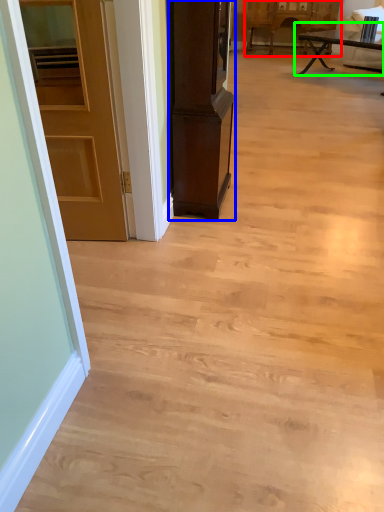
Question: Estimate the real-world distances between objects in this image. Which object is farther from cabinetry (highlighted by a red box), cabinetry (highlighted by a blue box) or table (highlighted by a green box)?

Choices:
 (A) cabinetry
 (B) table

Answer: (A)